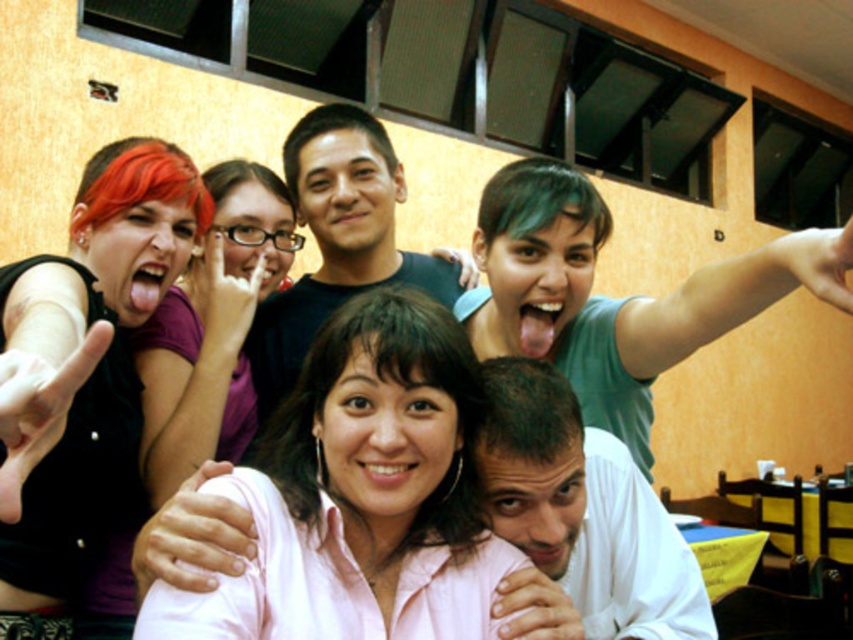
Question: Which of the following is the farthest from the observer?

Choices:
 (A) green matte shirt at upper right
 (B) smooth skin hand at center
 (C) white matte shirt at lower center

Answer: (C)

Question: Can you confirm if pink matte shirt at center is positioned above shiny black shirt at left?

Choices:
 (A) no
 (B) yes

Answer: (A)

Question: Which of the following is the farthest from the observer?

Choices:
 (A) matte black hand at upper center
 (B) pink matte shirt at center

Answer: (A)

Question: Observing the image, what is the correct spatial positioning of pink matte shirt at center in reference to shiny black shirt at left?

Choices:
 (A) below
 (B) above

Answer: (A)

Question: Which point is farther to the camera?

Choices:
 (A) (300, 314)
 (B) (146, 557)
 (C) (99, 458)

Answer: (A)

Question: Can you confirm if matte purple shirt at left is wider than black matte shirt at center?

Choices:
 (A) no
 (B) yes

Answer: (A)